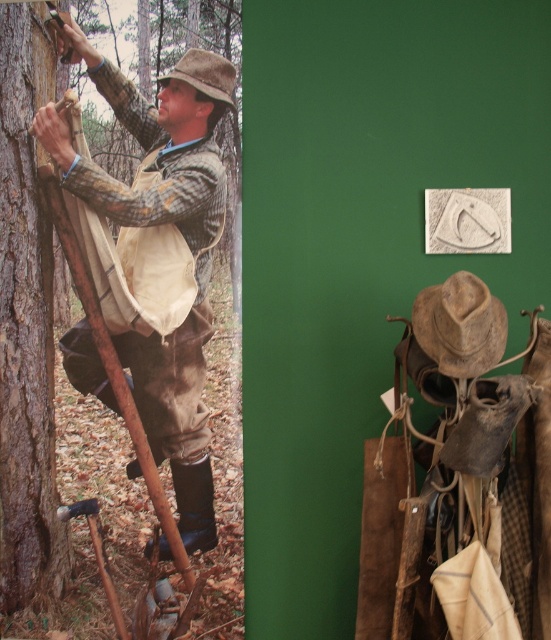
Question: Estimate the real-world distances between objects in this image. Which object is farther from the camouflage fabric shirt at left?

Choices:
 (A) camouflage fabric tree at left
 (B) brown leather cowboy hat at center

Answer: (B)

Question: Which object is the farthest from the smooth brown bark at left?

Choices:
 (A) camouflage fabric tree at left
 (B) brown leather cowboy hat at center
 (C) camouflage fabric shirt at left

Answer: (B)

Question: Can you confirm if camouflage fabric shirt at left is positioned to the right of camouflage fabric tree at left?

Choices:
 (A) yes
 (B) no

Answer: (B)

Question: Which point appears closest to the camera in this image?

Choices:
 (A) (153, 420)
 (B) (40, 204)

Answer: (B)

Question: From the image, what is the correct spatial relationship of camouflage fabric tree at left in relation to brown leather cowboy hat at center?

Choices:
 (A) left
 (B) right

Answer: (A)

Question: Is camouflage fabric tree at left smaller than brown leather cowboy hat at center?

Choices:
 (A) no
 (B) yes

Answer: (A)